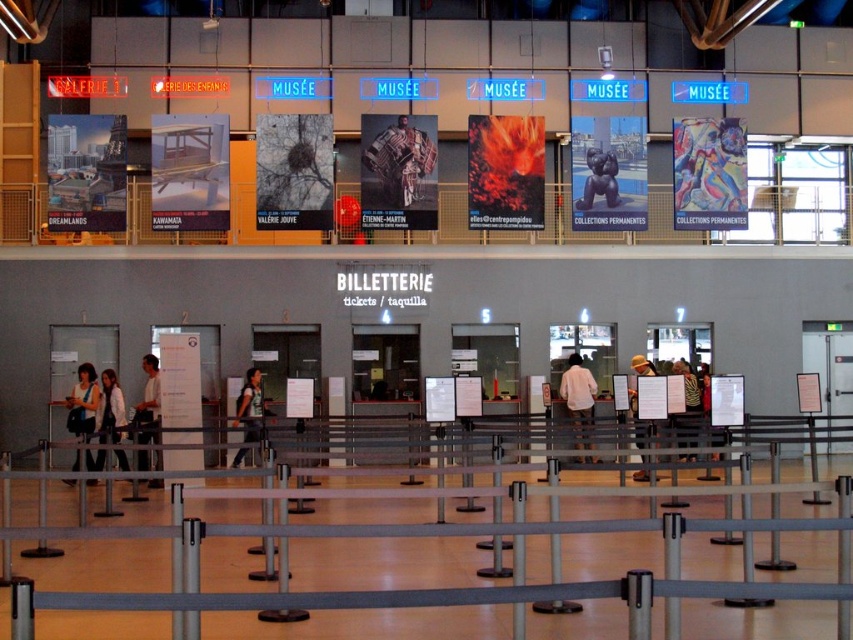
You are standing in the museum ticketing area and want to reach the point marked at coordinates point (584,404). There is an obstacle at point (141,454). Can you walk directly to your destination without going around the obstacle?

Point (584,404) is behind point (141,454), so you cannot walk directly to the destination without going around the obstacle.

You are a security guard in the museum and you need to check the items on the coat rack. You see a white matte shirt at center and a light brown leather jacket at center. Which one is positioned to the right side?

The white matte shirt at center is positioned to the right of the light brown leather jacket at center.